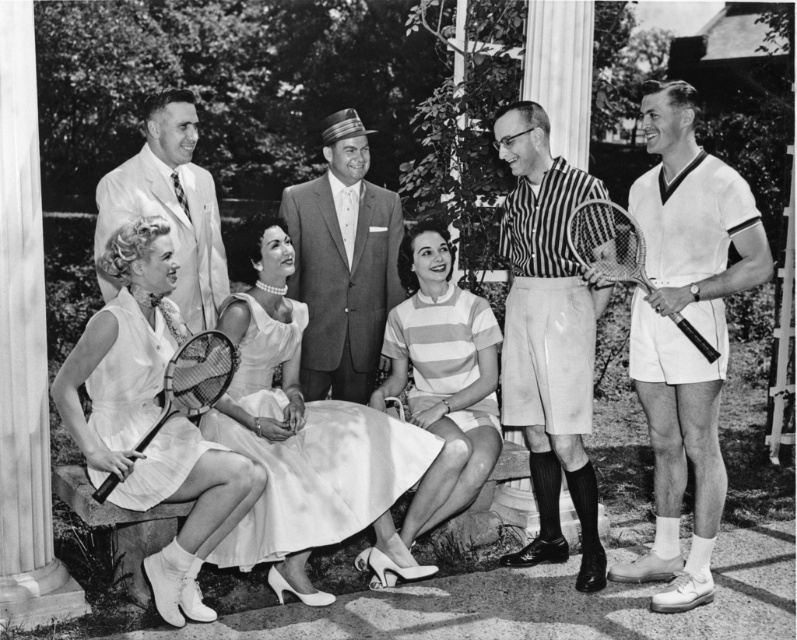
You are organizing a charity event and need to decide which outfit to display first. The striped jersey at center and the light beige suit at left are both available. Based on their sizes, which one should be chosen to make a more visually impactful display?

The striped jersey at center is larger in size compared to the light beige suit at left, so it would make a more visually impactful display due to its bigger size.

You are a photographer who wants to capture a clear shot of both the satin white dress at center and the matte white racket at lower left. Since the camera can only focus on one subject at a time, which object should you prioritize focusing on to ensure it appears sharp in the photo?

The satin white dress at center should be prioritized for focus because it is positioned below the matte white racket at lower left, meaning it is closer to the camera. Focusing on the dress will ensure it appears sharp, while the racket may be slightly out of focus due to its distance.

You are standing in the garden and want to find the striped jersey at center. According to the scene description, where would you look relative to the group of people?

The striped jersey at center is located at point (548, 337), so you should look towards the center area of the image where the group is gathered.